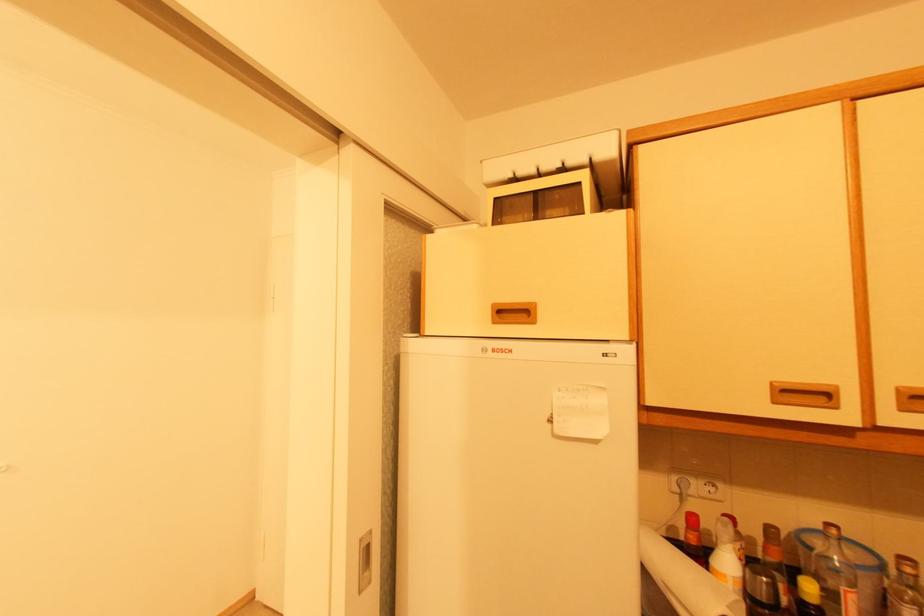
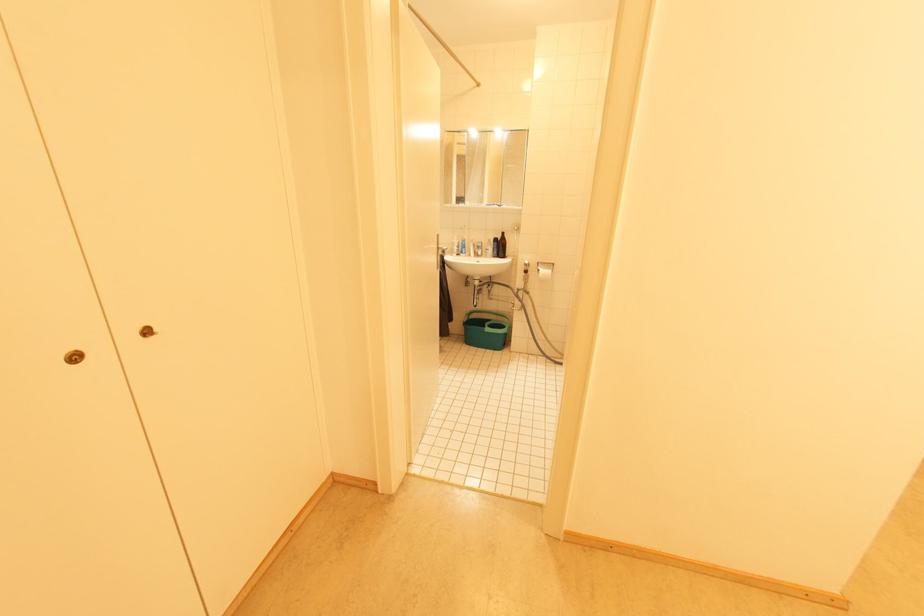
Question: What movement of the cameraman would produce the second image?

Choices:
 (A) Left
 (B) Right
 (C) Forward
 (D) Backward

Answer: (A)